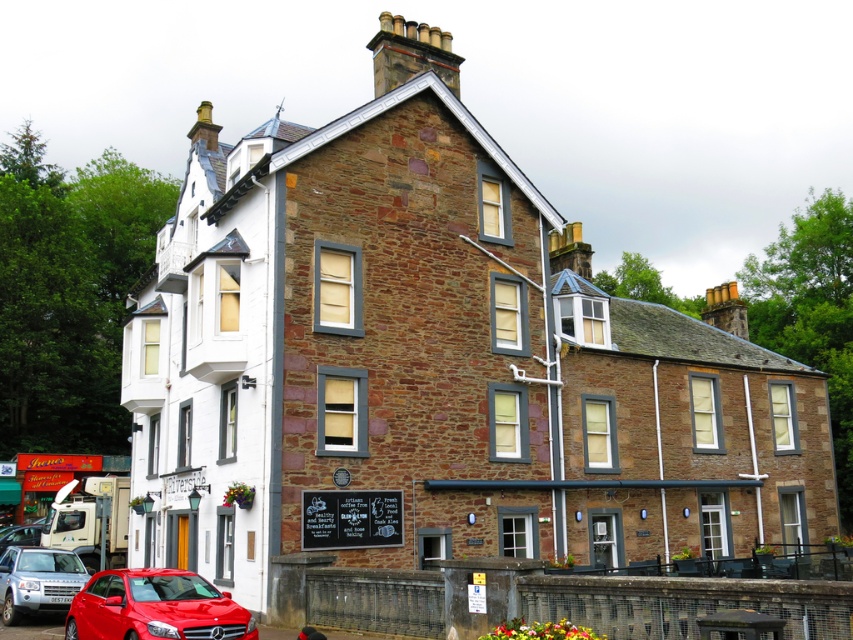
Is shiny red car at lower left to the right of metallic red car at lower left from the viewer's perspective?

Indeed, shiny red car at lower left is positioned on the right side of metallic red car at lower left.

Does shiny red car at lower left have a lesser height compared to metallic red car at lower left?

Incorrect, shiny red car at lower left's height does not fall short of metallic red car at lower left's.

Who is more distant from viewer, (74,618) or (22,593)?

The point (22,593) is behind.

Where is `shiny red car at lower left`? shiny red car at lower left is located at coordinates (155, 608).